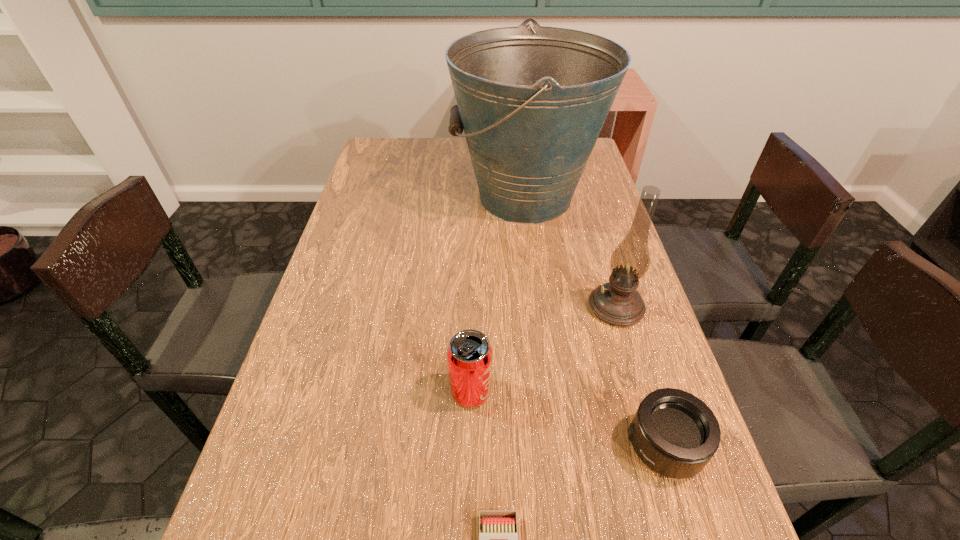
Where is `blank area located 0.050m with the handle on opposite sides of the tallest object`? The height and width of the screenshot is (540, 960). blank area located 0.050m with the handle on opposite sides of the tallest object is located at coordinates (436, 197).

This screenshot has height=540, width=960. I want to click on free location located on the left of the fourth shortest object, so click(x=484, y=307).

This screenshot has height=540, width=960. I want to click on free space located on the back of the third tallest object, so click(472, 298).

This screenshot has width=960, height=540. I want to click on vacant space located on the side of the telephoto lens with brand markings and control switches, so click(x=552, y=446).

You are a GUI agent. You are given a task and a screenshot of the screen. Output one action in this format:
    pyautogui.click(x=<x>, y=<y>)
    Task: Click on the blank area located 0.400m on the side of the telephoto lens with brand markings and control switches
    Image resolution: width=960 pixels, height=540 pixels.
    Given the screenshot: What is the action you would take?
    pyautogui.click(x=399, y=446)

The width and height of the screenshot is (960, 540). Identify the location of vacant space positioned 0.160m on the side of the telephoto lens with brand markings and control switches. (536, 446).

What are the coordinates of `object located at the far edge` in the screenshot? It's located at (532, 102).

Identify the location of bucket that is at the right edge. (532, 102).

At what (x,y) coordinates should I click in order to perform the action: click on oil lamp at the right edge. Please return your answer as a coordinate pair (x, y). This screenshot has height=540, width=960. Looking at the image, I should click on (618, 303).

Where is `telephoto lens positioned at the right edge`? The image size is (960, 540). telephoto lens positioned at the right edge is located at coordinates coord(674,433).